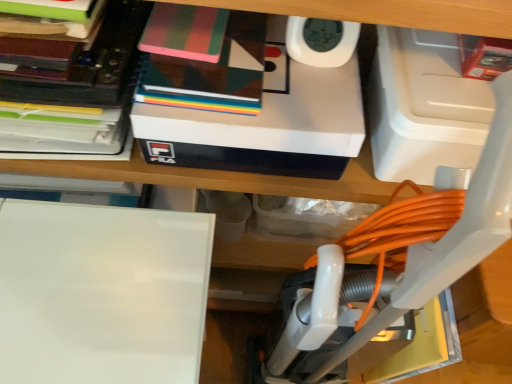
I want to click on unoccupied region to the right of multicolored paper at upper center, so click(293, 84).